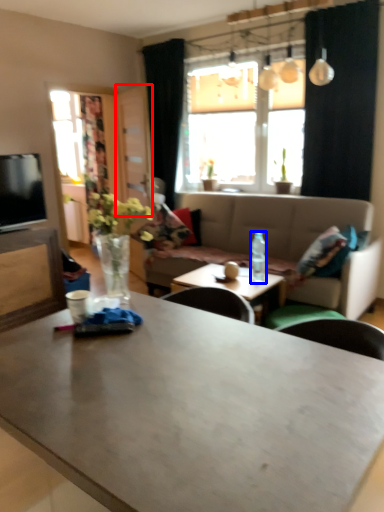
Question: Which object appears closest to the camera in this image, glass door (highlighted by a red box) or bottle (highlighted by a blue box)?

Choices:
 (A) glass door
 (B) bottle

Answer: (B)